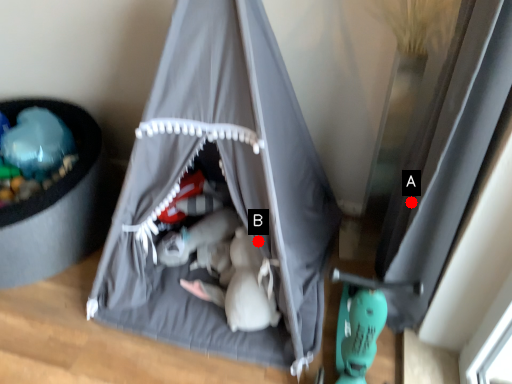
Question: Two points are circled on the image, labeled by A and B beside each circle. Which point is farther to the camera?

Choices:
 (A) A is further
 (B) B is further

Answer: (B)